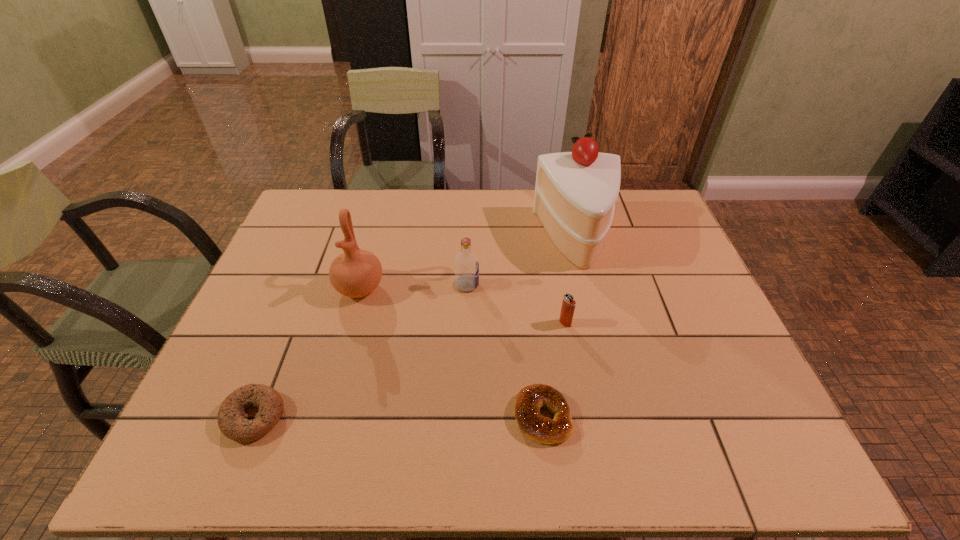
Image resolution: width=960 pixels, height=540 pixels. I want to click on vacant point located 0.340m on the spout of the pottery, so click(x=323, y=426).

Locate an element on the screen. vacant space situated 0.300m on the label of the vodka is located at coordinates (587, 285).

Locate an element on the screen. This screenshot has height=540, width=960. vacant area situated on the front of the fourth farthest object is located at coordinates (571, 356).

Locate an element on the screen. This screenshot has width=960, height=540. free space located on the right of the leftmost object is located at coordinates (439, 416).

You are a GUI agent. You are given a task and a screenshot of the screen. Output one action in this format:
    pyautogui.click(x=<x>, y=<y>)
    Task: Click on the free region located on the back of the right bagel
    This screenshot has height=540, width=960.
    Given the screenshot: What is the action you would take?
    pyautogui.click(x=530, y=307)

The height and width of the screenshot is (540, 960). What are the coordinates of `object present at the far edge` in the screenshot? It's located at (575, 192).

The width and height of the screenshot is (960, 540). I want to click on object that is at the left edge, so click(x=231, y=416).

At what (x,y) coordinates should I click in order to perform the action: click on object present at the near left corner. Please return your answer as a coordinate pair (x, y). The width and height of the screenshot is (960, 540). Looking at the image, I should click on (231, 416).

Identify the location of vacant space at the far edge. (526, 190).

The height and width of the screenshot is (540, 960). In order to click on free space at the near edge of the desktop in this screenshot , I will do `click(430, 469)`.